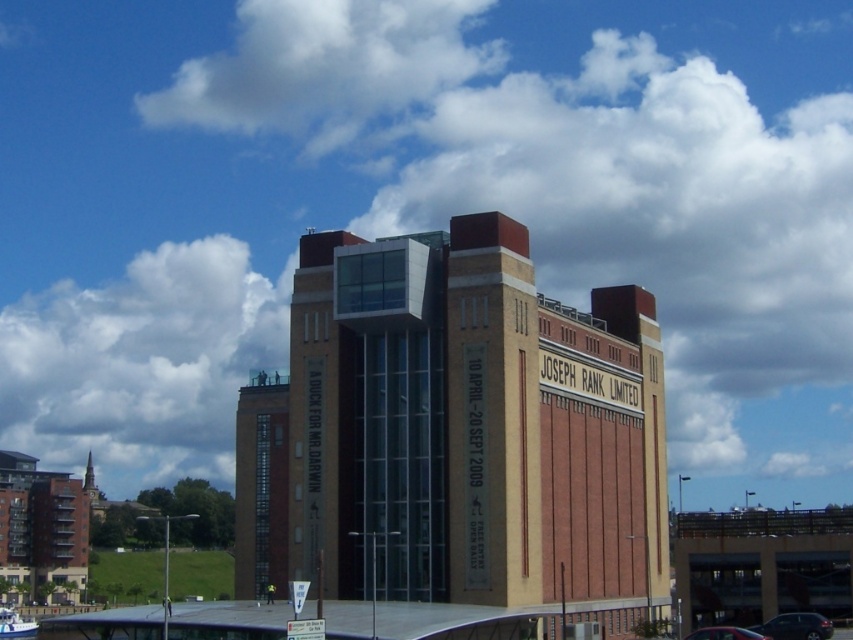
Between white fluffy cloud at upper left and metallic silver car at center, which one appears on the left side from the viewer's perspective?

From the viewer's perspective, white fluffy cloud at upper left appears more on the left side.

Which is behind, point (143, 317) or point (689, 636)?

Point (143, 317)

Identify the location of white fluffy cloud at upper left. (141, 364).

Which is more to the right, white fluffy cloud at upper center or shiny black car at lower right?

From the viewer's perspective, shiny black car at lower right appears more on the right side.

Does white fluffy cloud at upper center have a greater height compared to shiny black car at lower right?

Yes, white fluffy cloud at upper center is taller than shiny black car at lower right.

Which is in front, point (311, 80) or point (828, 625)?

Positioned in front is point (828, 625).

Find the location of a particular element. This screenshot has width=853, height=640. white fluffy cloud at upper center is located at coordinates coord(323,68).

Which is above, shiny black car at lower right or metallic silver car at center?

Positioned higher is metallic silver car at center.

Between shiny black car at lower right and metallic silver car at center, which one appears on the left side from the viewer's perspective?

Positioned to the left is metallic silver car at center.

Between point (824, 618) and point (749, 634), which one is positioned behind?

Point (824, 618)

This screenshot has height=640, width=853. I want to click on shiny black car at lower right, so click(796, 627).